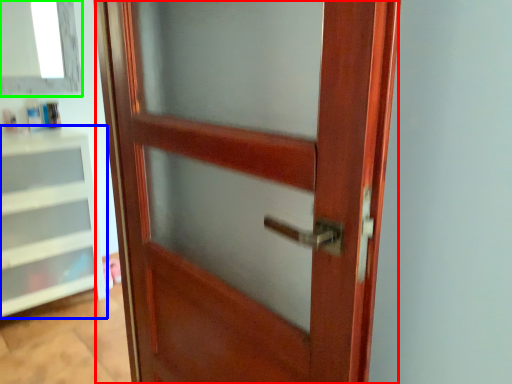
Question: Which object is positioned closest to door (highlighted by a red box)? Select from shelf (highlighted by a blue box) and window (highlighted by a green box).

Choices:
 (A) shelf
 (B) window

Answer: (A)